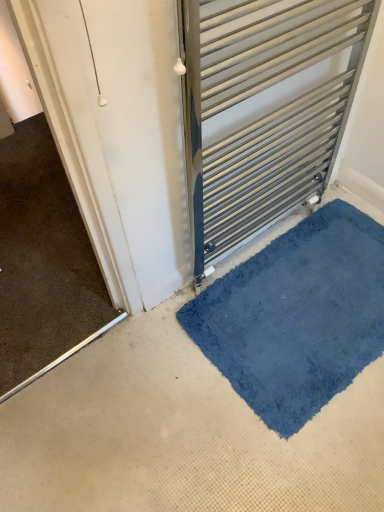
Where is `vacant region under blue plush bath mat at lower right (from a real-world perspective)`? vacant region under blue plush bath mat at lower right (from a real-world perspective) is located at coordinates (296, 308).